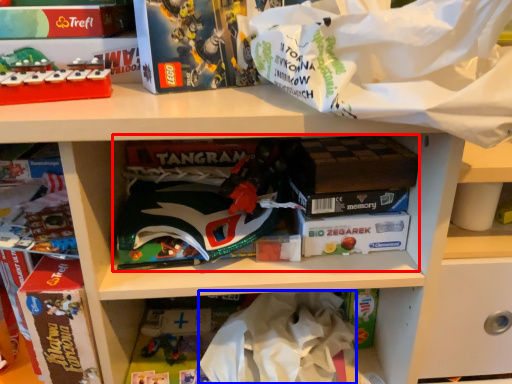
Question: Which object is further to the camera taking this photo, book (highlighted by a red box) or clothing (highlighted by a blue box)?

Choices:
 (A) book
 (B) clothing

Answer: (B)